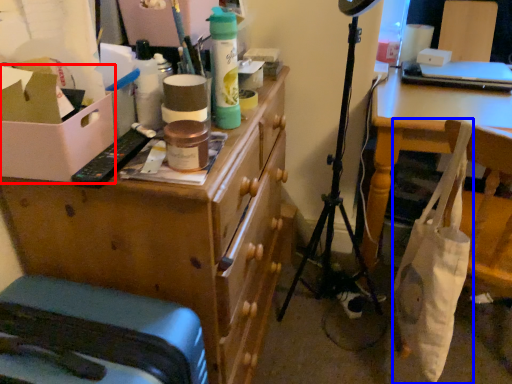
Question: Which object is further to the camera taking this photo, cardboard box (highlighted by a red box) or bag (highlighted by a blue box)?

Choices:
 (A) cardboard box
 (B) bag

Answer: (B)